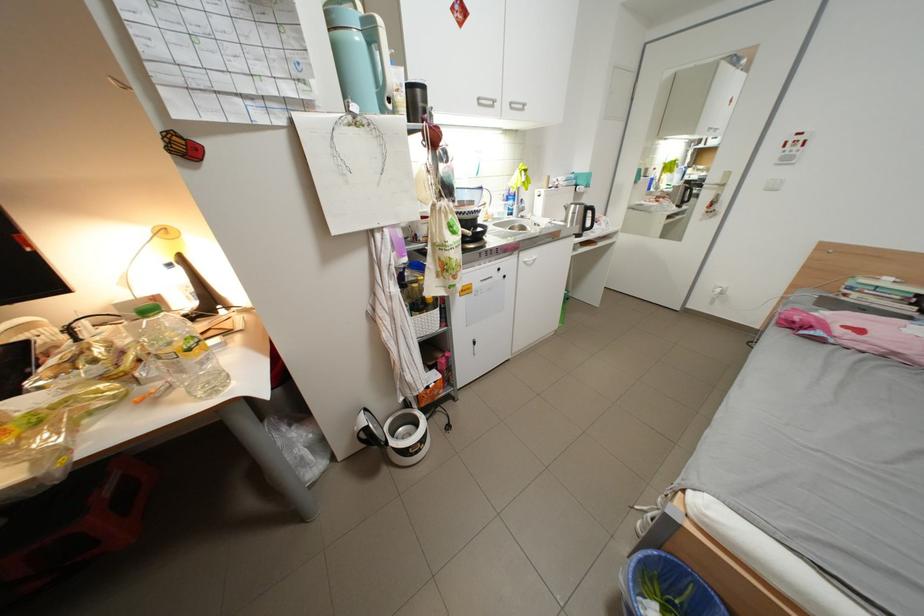
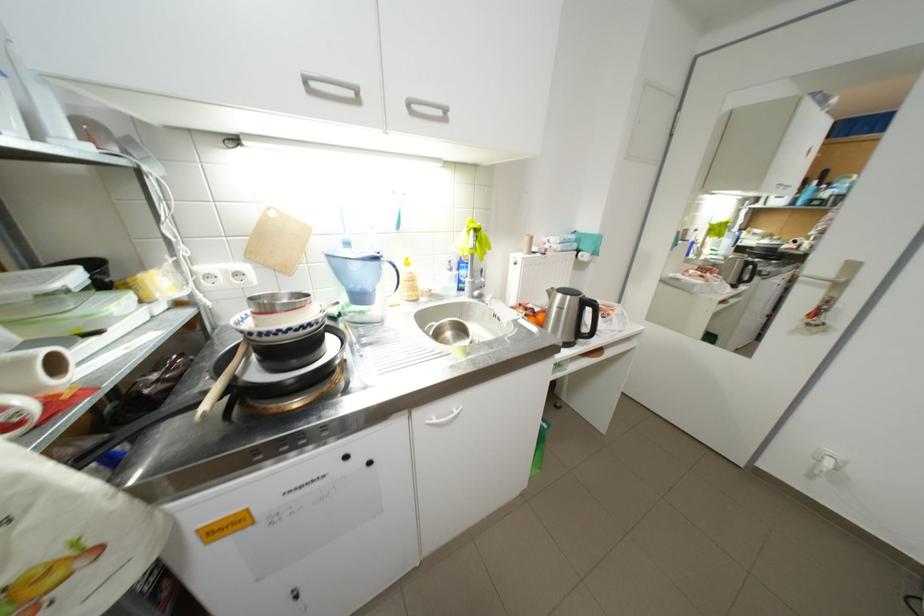
In the second image, find the point that corresponds to pixel 523 204 in the first image.

(475, 273)